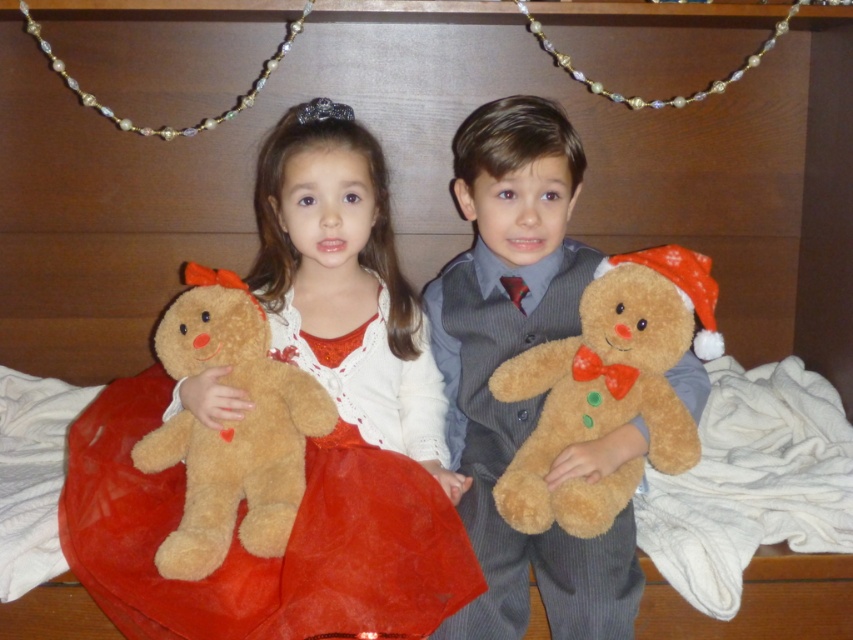
Is velvety red dress at center thinner than fuzzy brown teddy bear at right?

No, velvety red dress at center is not thinner than fuzzy brown teddy bear at right.

Between velvety red dress at center and fuzzy brown teddy bear at right, which one is positioned lower?

Positioned lower is velvety red dress at center.

Is point (357, 508) less distant than point (538, 474)?

Yes, it is.

Locate an element on the screen. The width and height of the screenshot is (853, 640). velvety red dress at center is located at coordinates (265, 560).

Does fuzzy brown teddy bear at right have a greater width compared to fuzzy brown teddy bear at left?

Correct, the width of fuzzy brown teddy bear at right exceeds that of fuzzy brown teddy bear at left.

Identify the location of fuzzy brown teddy bear at right. click(608, 387).

Between point (592, 324) and point (329, 432), which one is positioned in front?

Point (592, 324) is more forward.

Where is `fuzzy brown teddy bear at right`? This screenshot has height=640, width=853. fuzzy brown teddy bear at right is located at coordinates (608, 387).

Is fuzzy brown teddy bear at center in front of velvety red dress at center?

No, it is not.

Between point (525, 324) and point (276, 628), which one is positioned in front?

Point (276, 628) is in front.

Identify the location of fuzzy brown teddy bear at center. This screenshot has height=640, width=853. (511, 356).

This screenshot has width=853, height=640. In order to click on fuzzy brown teddy bear at center in this screenshot , I will do `click(511, 356)`.